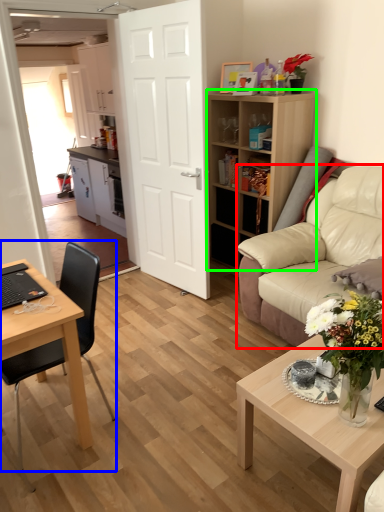
Question: Considering the real-world distances, which object is farthest from studio couch (highlighted by a red box)? chair (highlighted by a blue box) or shelf (highlighted by a green box)?

Choices:
 (A) chair
 (B) shelf

Answer: (A)